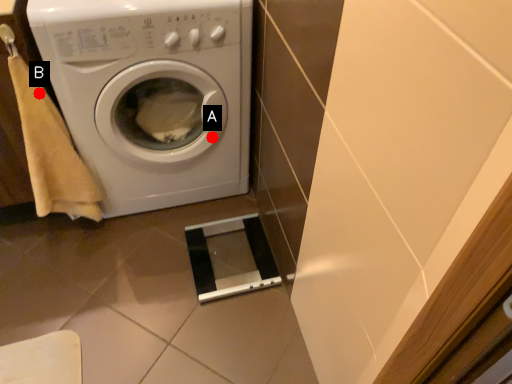
Question: Two points are circled on the image, labeled by A and B beside each circle. Which point is closer to the camera taking this photo?

Choices:
 (A) A is closer
 (B) B is closer

Answer: (B)